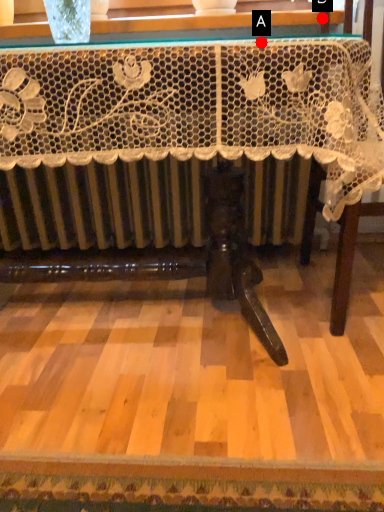
Question: Two points are circled on the image, labeled by A and B beside each circle. Which point is closer to the camera?

Choices:
 (A) A is closer
 (B) B is closer

Answer: (A)